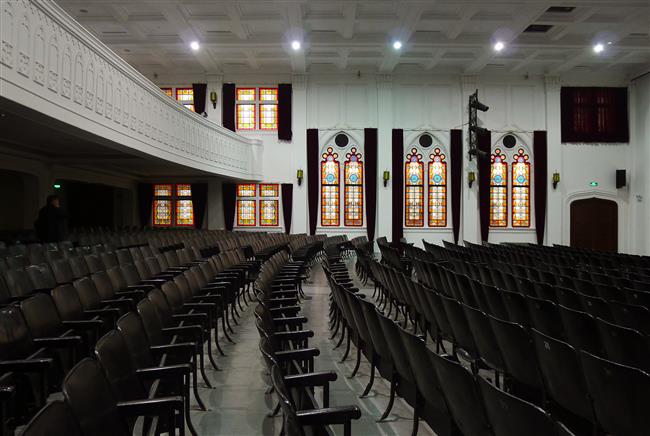
I want to click on doors, so click(x=585, y=222), click(x=600, y=220).